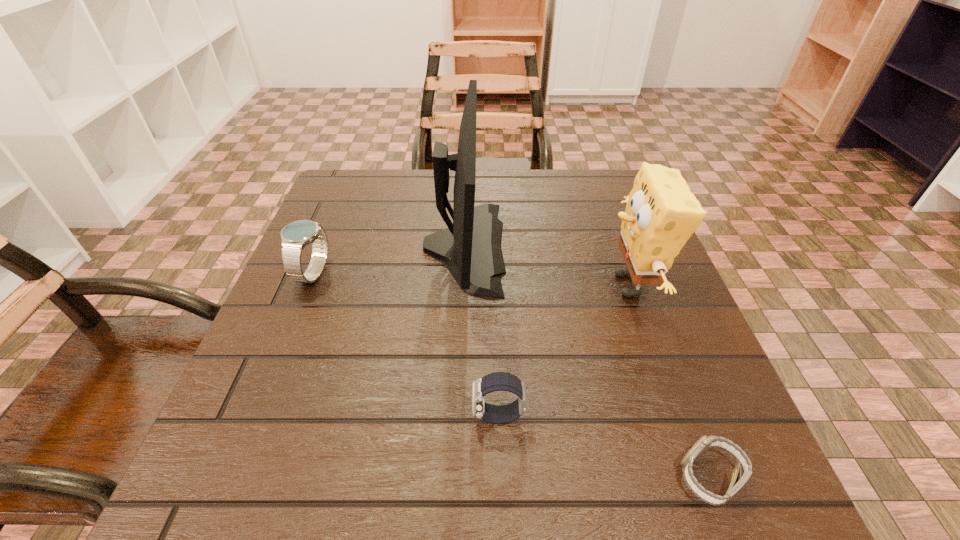
Find the location of `free space at the near right corner of the desktop`. free space at the near right corner of the desktop is located at coordinates (709, 483).

Identify the location of vacant space that's between the farthest watch and the second nearest watch. Image resolution: width=960 pixels, height=540 pixels. (406, 345).

Identify the location of blank region between the second tallest object and the second tallest watch. The width and height of the screenshot is (960, 540). (564, 350).

Identify the location of empty location between the tallest object and the fourth tallest object. The width and height of the screenshot is (960, 540). click(x=481, y=332).

You are a GUI agent. You are given a task and a screenshot of the screen. Output one action in this format:
    pyautogui.click(x=<x>, y=<y>)
    Task: Click on the free space between the third shortest object and the tallest object
    Image resolution: width=960 pixels, height=540 pixels.
    Given the screenshot: What is the action you would take?
    pyautogui.click(x=389, y=260)

I want to click on vacant region between the monitor and the leftmost object, so click(389, 260).

What are the coordinates of `free space that is in between the monitor and the nearest object` in the screenshot? It's located at (588, 362).

At what (x,y) coordinates should I click in order to perform the action: click on empty space between the second nearest object and the shortest object. Please return your answer as a coordinate pair (x, y). This screenshot has width=960, height=540. Looking at the image, I should click on (604, 447).

Where is `free space between the monitor and the rightmost watch`? The height and width of the screenshot is (540, 960). free space between the monitor and the rightmost watch is located at coordinates (588, 362).

Where is `object that ranks as the second closest to the leftmost object`? object that ranks as the second closest to the leftmost object is located at coordinates (497, 381).